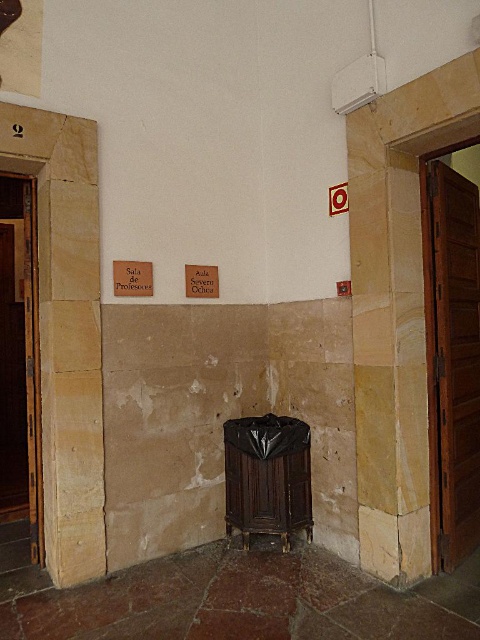
Question: Can you confirm if brown wooden door at right is smaller than brown wooden door at left?

Choices:
 (A) yes
 (B) no

Answer: (A)

Question: Is brown wooden door at right to the right of brown wooden door at left from the viewer's perspective?

Choices:
 (A) no
 (B) yes

Answer: (B)

Question: Does brown wooden door at right appear on the left side of brown wooden door at left?

Choices:
 (A) yes
 (B) no

Answer: (B)